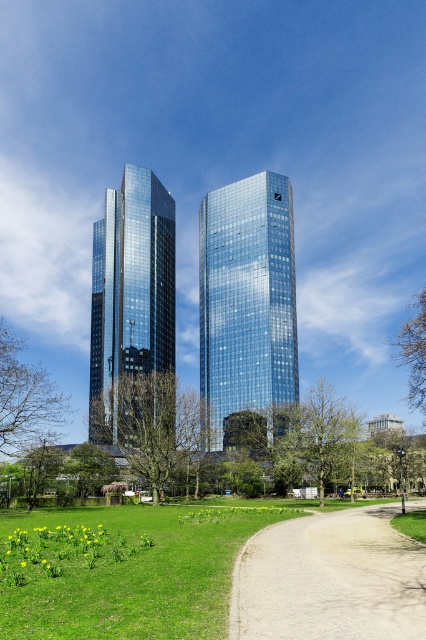
Question: Can you confirm if green grass at lower left is positioned above shiny glass skyscraper at center?

Choices:
 (A) yes
 (B) no

Answer: (B)

Question: Which is nearer to the shiny glass skyscraper at center?

Choices:
 (A) green leafy tree at right
 (B) green grass at lower left
 (C) green leafy tree at left
 (D) gravel path at center

Answer: (B)

Question: Is glossy glass skyscraper at center further to camera compared to shiny glass skyscraper at center?

Choices:
 (A) no
 (B) yes

Answer: (A)

Question: Which point appears farthest from the camera in this image?

Choices:
 (A) (137, 429)
 (B) (100, 285)
 (C) (138, 566)
 (D) (14, 365)

Answer: (B)

Question: Which point appears farthest from the camera in this image?

Choices:
 (A) (423, 294)
 (B) (207, 273)
 (C) (48, 392)
 (D) (382, 604)

Answer: (B)

Question: Is gravel path at center wider than shiny glass skyscraper at center?

Choices:
 (A) yes
 (B) no

Answer: (B)